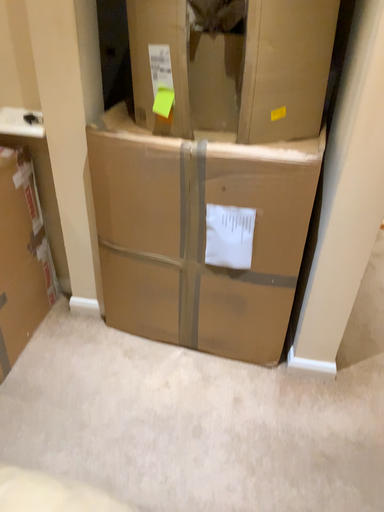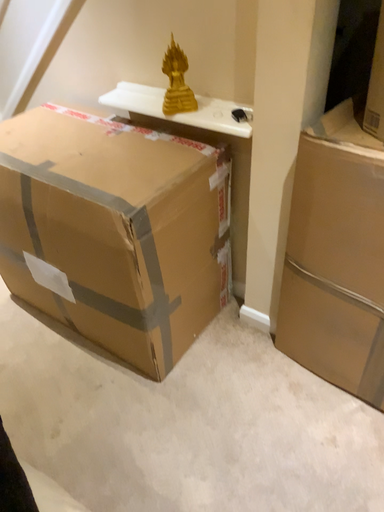
Question: How did the camera likely rotate when shooting the video?

Choices:
 (A) rotated left
 (B) rotated right

Answer: (A)